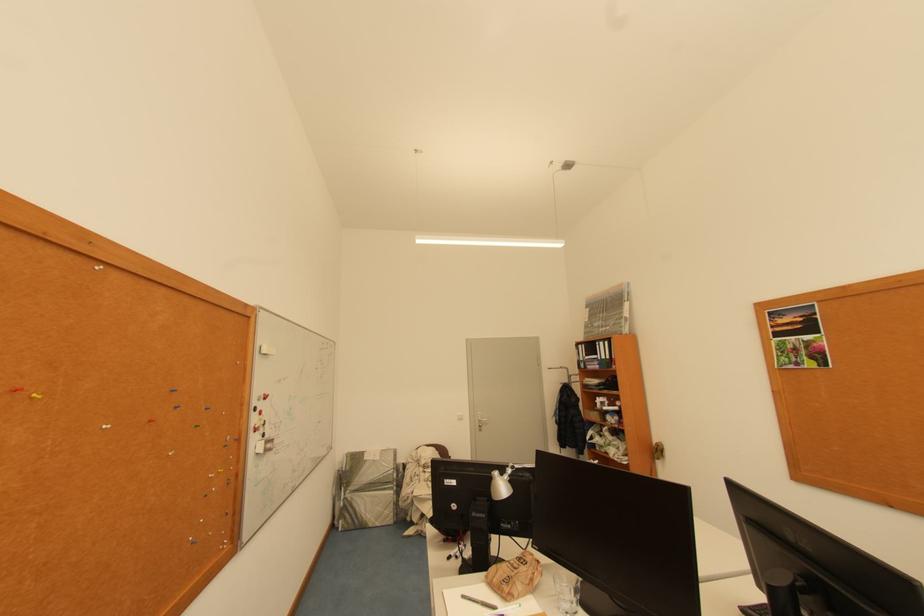
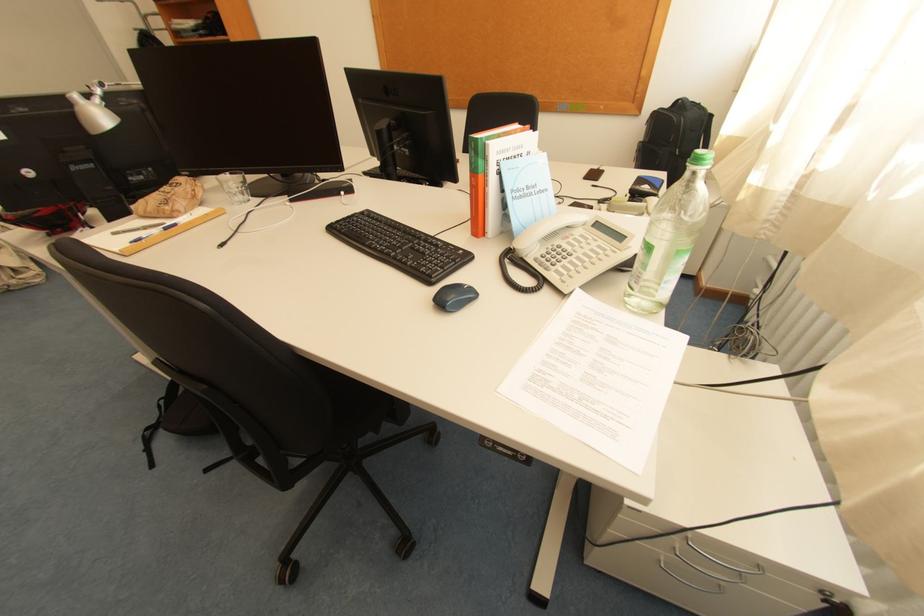
In the second image, find the point that corresponds to pixel 520 469 in the first image.

(110, 86)